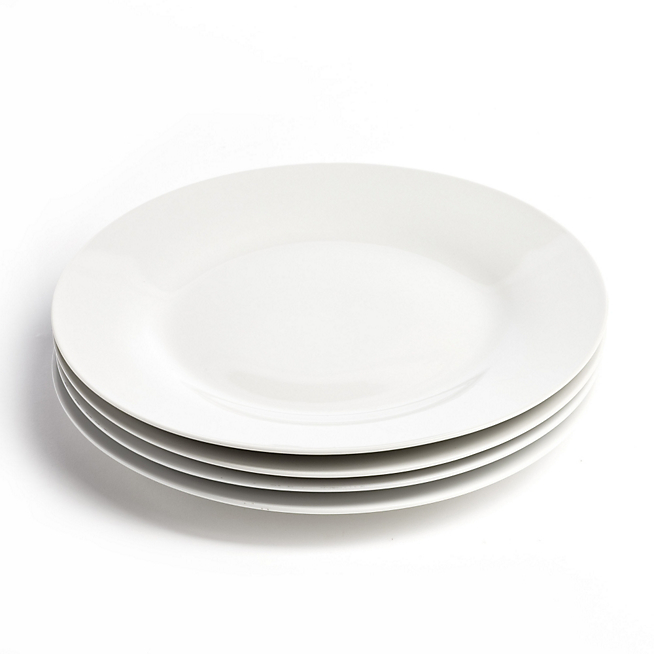
Image resolution: width=654 pixels, height=654 pixels. I want to click on plates, so click(332, 452), click(335, 473), click(339, 489), click(341, 508).